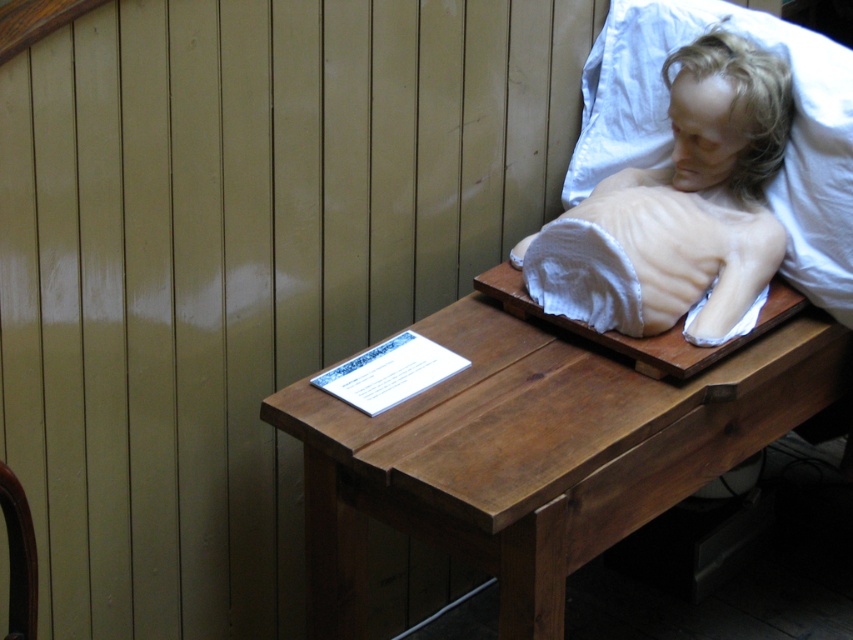
Where is `wooden table at center`? wooden table at center is located at coordinates coord(543,444).

In the scene shown: Can you confirm if wooden table at center is positioned to the left of smooth beige wax at upper right?

Correct, you'll find wooden table at center to the left of smooth beige wax at upper right.

Describe the element at coordinates (543, 444) in the screenshot. The width and height of the screenshot is (853, 640). I see `wooden table at center` at that location.

You are a GUI agent. You are given a task and a screenshot of the screen. Output one action in this format:
    pyautogui.click(x=<x>, y=<y>)
    Task: Click on the wooden table at center
    This screenshot has height=640, width=853.
    Given the screenshot: What is the action you would take?
    pyautogui.click(x=543, y=444)